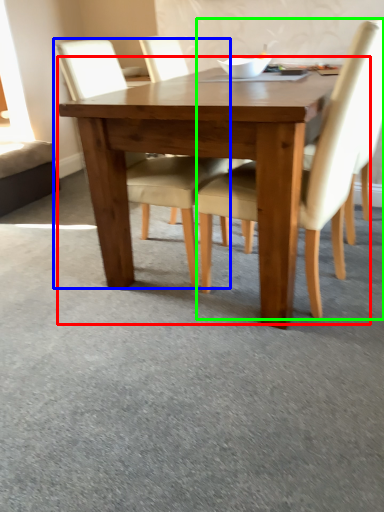
Question: Estimate the real-world distances between objects in this image. Which object is closer to kitchen & dining room table (highlighted by a red box), chair (highlighted by a blue box) or chair (highlighted by a green box)?

Choices:
 (A) chair
 (B) chair

Answer: (A)